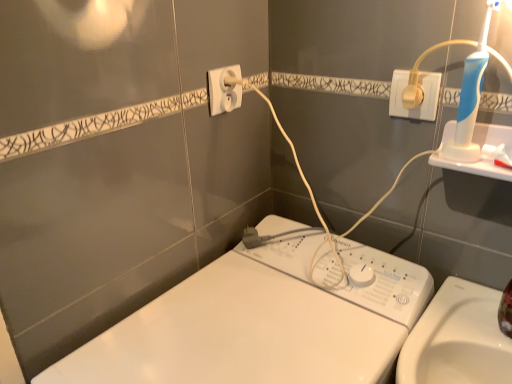
Question: Should I look upward or downward to see white plastic washing machine at center?

Choices:
 (A) down
 (B) up

Answer: (A)

Question: Can you confirm if white plastic socket at upper center, the 1th power plugs and sockets positioned from the left, is bigger than white plastic plug at upper right, which is the 2th power plugs and sockets in left-to-right order?

Choices:
 (A) no
 (B) yes

Answer: (B)

Question: Would you say white plastic socket at upper center, marked as the 2th power plugs and sockets in a right-to-left arrangement, is a long distance from white plastic plug at upper right, which is the 2th power plugs and sockets in left-to-right order?

Choices:
 (A) no
 (B) yes

Answer: (A)

Question: Is white plastic socket at upper center, the 1th power plugs and sockets positioned from the left, to the right of white plastic plug at upper right, which is the 2th power plugs and sockets in left-to-right order, from the viewer's perspective?

Choices:
 (A) yes
 (B) no

Answer: (B)

Question: Is white plastic socket at upper center, the 1th power plugs and sockets positioned from the left, shorter than white plastic plug at upper right, arranged as the first power plugs and sockets when viewed from the right?

Choices:
 (A) yes
 (B) no

Answer: (B)

Question: Is white plastic socket at upper center, the 1th power plugs and sockets positioned from the left, beside white plastic plug at upper right, which is the 2th power plugs and sockets in left-to-right order?

Choices:
 (A) no
 (B) yes

Answer: (A)

Question: Is white plastic socket at upper center, the 1th power plugs and sockets positioned from the left, behind white plastic plug at upper right, which is the 2th power plugs and sockets in left-to-right order?

Choices:
 (A) no
 (B) yes

Answer: (B)

Question: From a real-world perspective, does white plastic washing machine at center sit lower than white plastic plug at upper right, which is the 2th power plugs and sockets in left-to-right order?

Choices:
 (A) yes
 (B) no

Answer: (A)

Question: Does white plastic washing machine at center come behind white plastic plug at upper right, which is the 2th power plugs and sockets in left-to-right order?

Choices:
 (A) yes
 (B) no

Answer: (B)

Question: Can you confirm if white plastic washing machine at center is positioned to the left of white plastic plug at upper right, arranged as the first power plugs and sockets when viewed from the right?

Choices:
 (A) no
 (B) yes

Answer: (B)

Question: Considering the relative sizes of white plastic washing machine at center and white plastic plug at upper right, which is the 2th power plugs and sockets in left-to-right order, in the image provided, is white plastic washing machine at center taller than white plastic plug at upper right, which is the 2th power plugs and sockets in left-to-right order,?

Choices:
 (A) no
 (B) yes

Answer: (B)

Question: Does white plastic washing machine at center have a lesser height compared to white plastic plug at upper right, arranged as the first power plugs and sockets when viewed from the right?

Choices:
 (A) yes
 (B) no

Answer: (B)

Question: From a real-world perspective, is white plastic washing machine at center positioned over white plastic plug at upper right, which is the 2th power plugs and sockets in left-to-right order, based on gravity?

Choices:
 (A) no
 (B) yes

Answer: (A)

Question: Is white plastic socket at upper center, marked as the 2th power plugs and sockets in a right-to-left arrangement, located within white plastic washing machine at center?

Choices:
 (A) no
 (B) yes

Answer: (A)